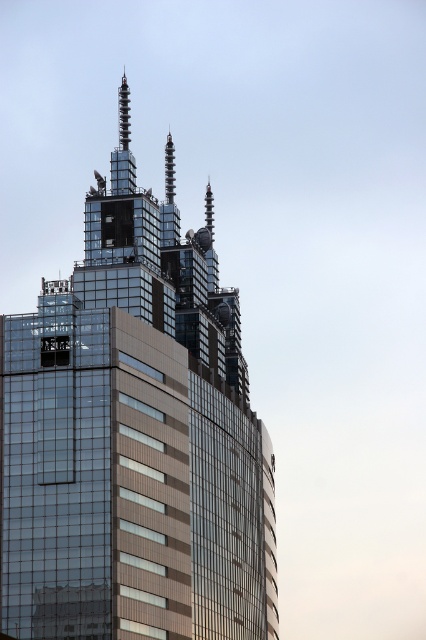
You are an architect evaluating the structural integrity of the glassy metallic skyscraper at center and the shiny metallic spire at center. Which structure would require more material to construct based on their sizes?

The glassy metallic skyscraper at center is larger in size than the shiny metallic spire at center, so it would require more material to construct.

You are standing at the base of the skyscraper and see the point marked at coordinates (169, 170). Based on the description, where exactly is this point located on the building?

The point marked at coordinates (169, 170) is located on the shiny metallic spire at the center of the building.